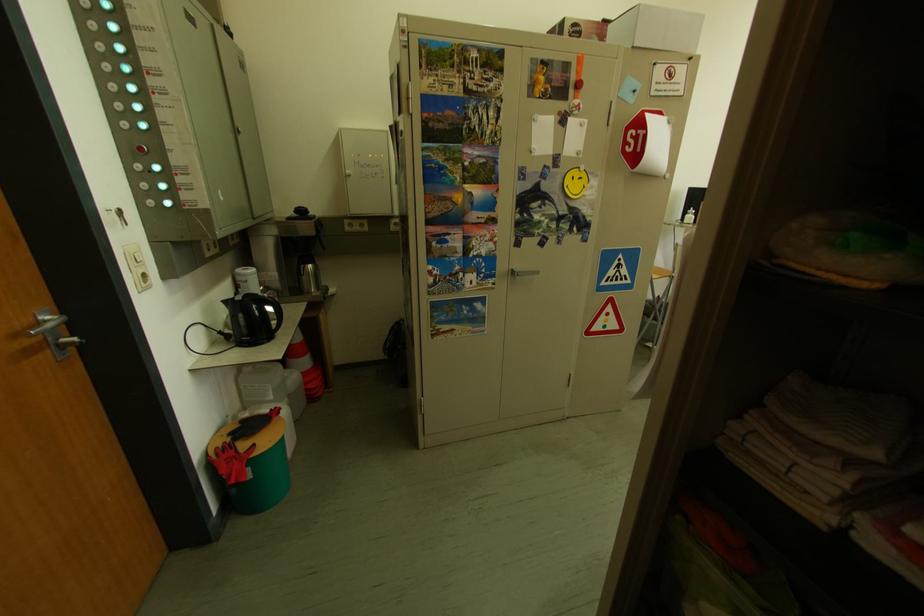
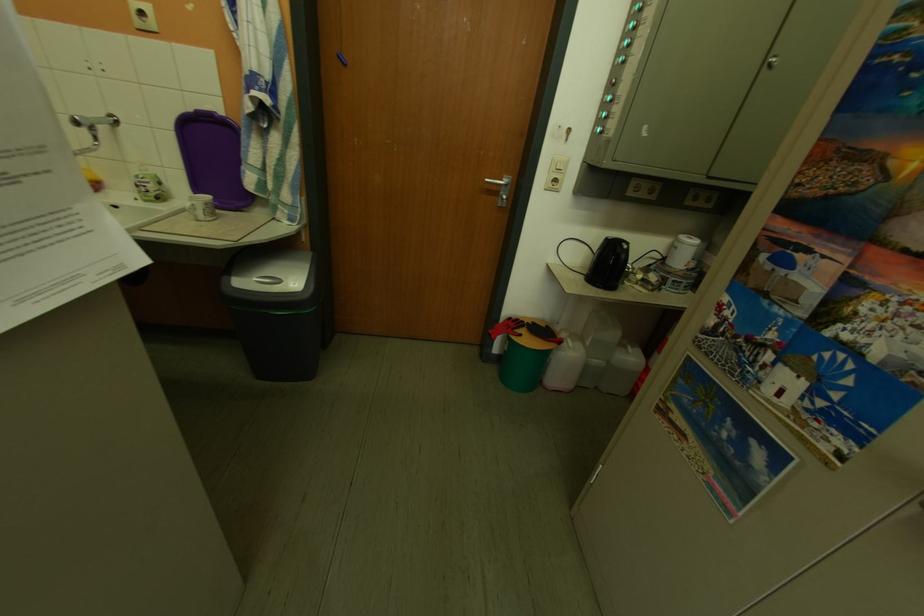
The point at (284, 400) is marked in the first image. Where is the corresponding point in the second image?

(602, 346)